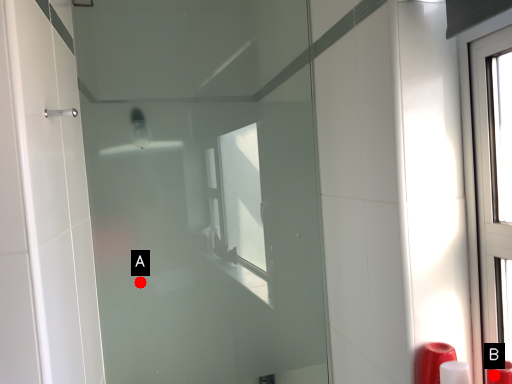
Question: Two points are circled on the image, labeled by A and B beside each circle. Which point is farther from the camera taking this photo?

Choices:
 (A) A is further
 (B) B is further

Answer: (A)